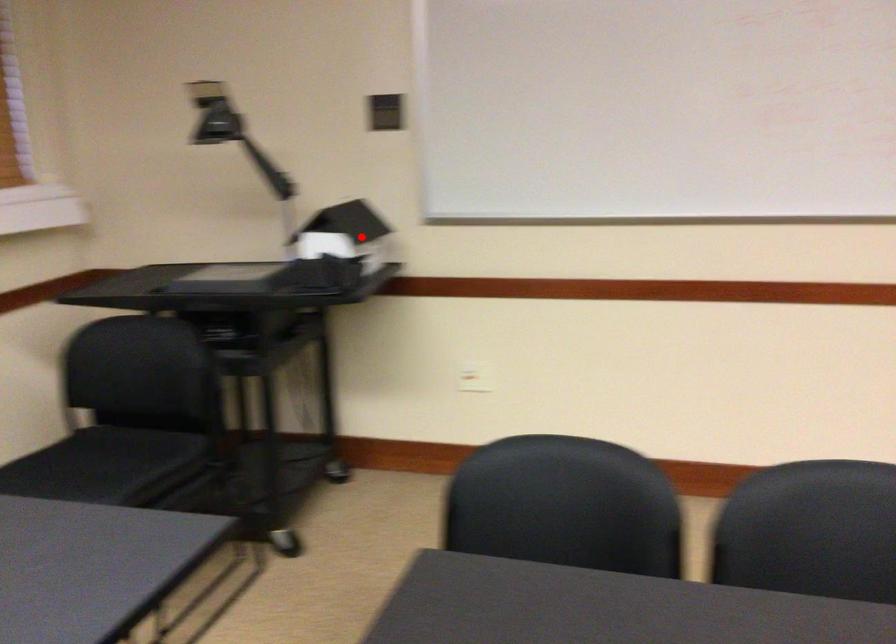
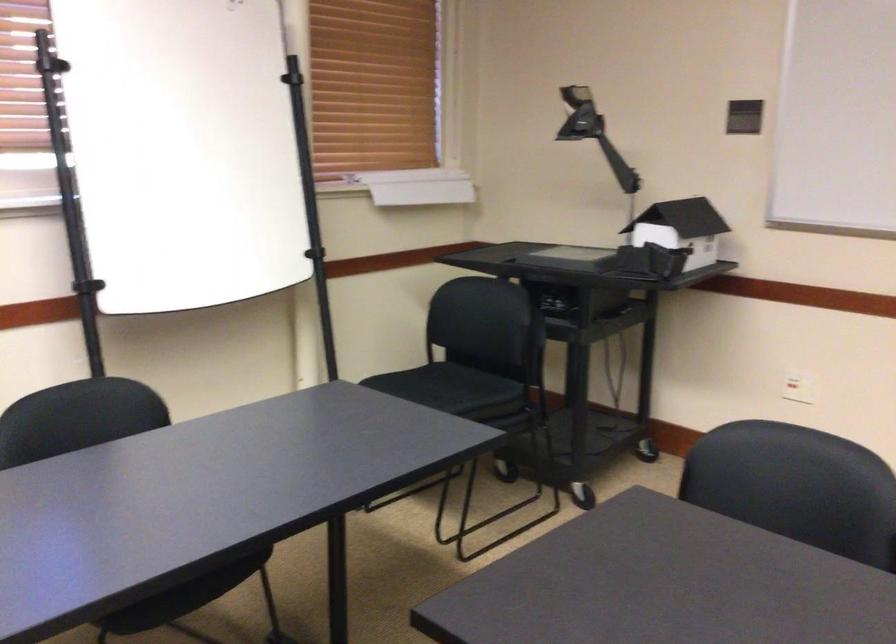
The point at the highlighted location is marked in the first image. Where is the corresponding point in the second image?

(681, 229)